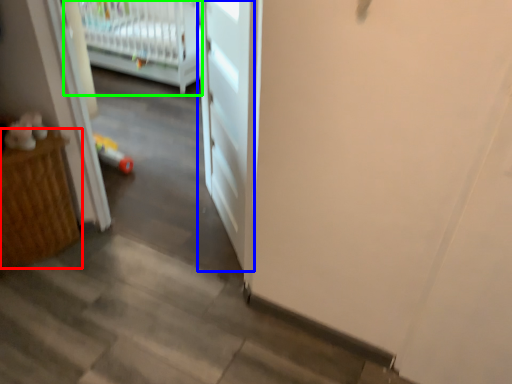
Question: Which object is the closest to the furniture (highlighted by a red box)? Choose among these: door (highlighted by a blue box) or infant bed (highlighted by a green box).

Choices:
 (A) door
 (B) infant bed

Answer: (A)